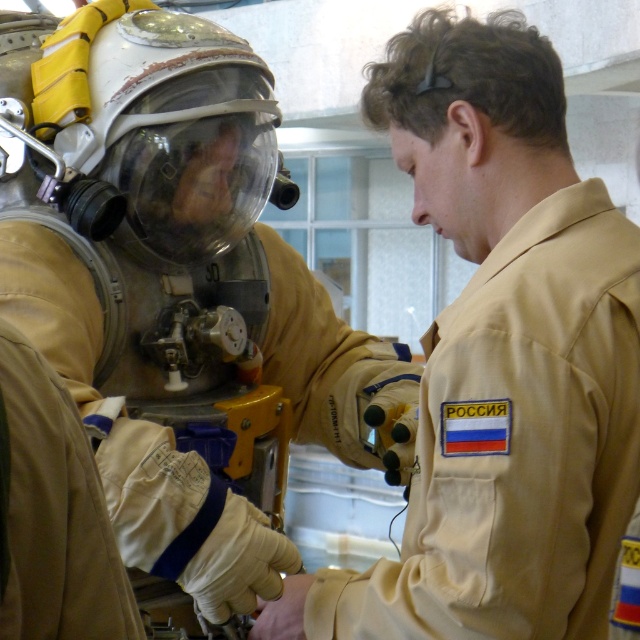
What are the coordinates of the beige fabric uniform at center?

The beige fabric uniform at center is located at coordinates point (179, 294).

Based on the scene description, which uniform, the beige fabric uniform at center or the tan fabric uniform at center, is wider?

The beige fabric uniform at center might be wider than tan fabric uniform at center.

You are an astronaut preparing for a spacewalk. You see two uniforms at the center of the storage area. Which uniform is positioned higher? The beige fabric uniform at center or the tan fabric uniform at center?

The beige fabric uniform at center is positioned higher than the tan fabric uniform at center.